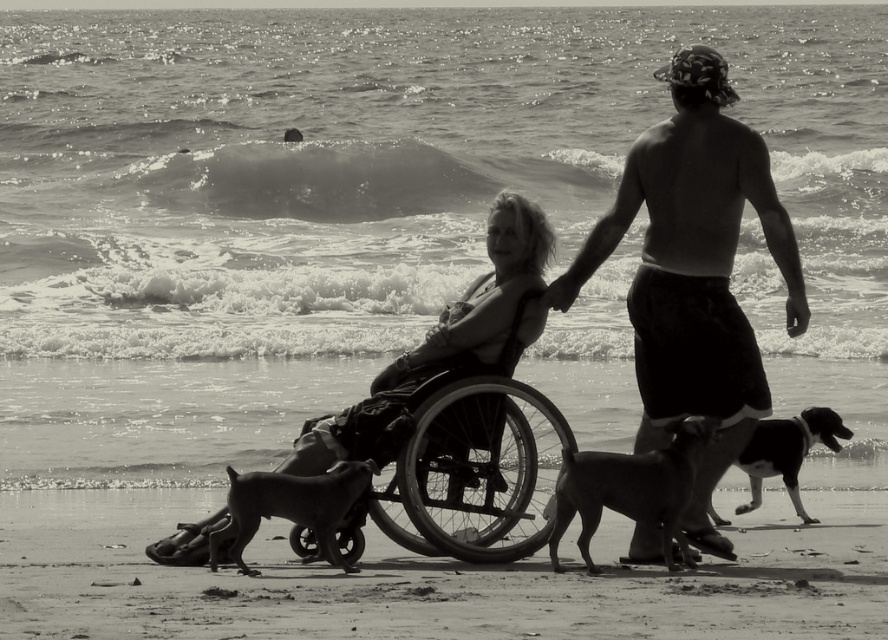
You are a photographer trying to capture a candid shot of the dark skin shirtless torso at center and the smooth brown dog at lower right. Since you want both subjects to appear balanced in the frame, which subject should you position closer to the camera?

The smooth brown dog at lower right should be positioned closer to the camera because the dark skin shirtless torso at center is larger in size than the smooth brown dog at lower right, so bringing the smaller subject closer can help balance their sizes in the photo.

You are a photographer taking a picture of the beach scene described. The smooth brown dog at lower right is an important subject. Where should you position your camera to ensure the dog is centered in the photo?

To center the smooth brown dog at lower right in the photo, position the camera so that the dog is at the coordinates point [631,490], which would place it in the center of the frame.